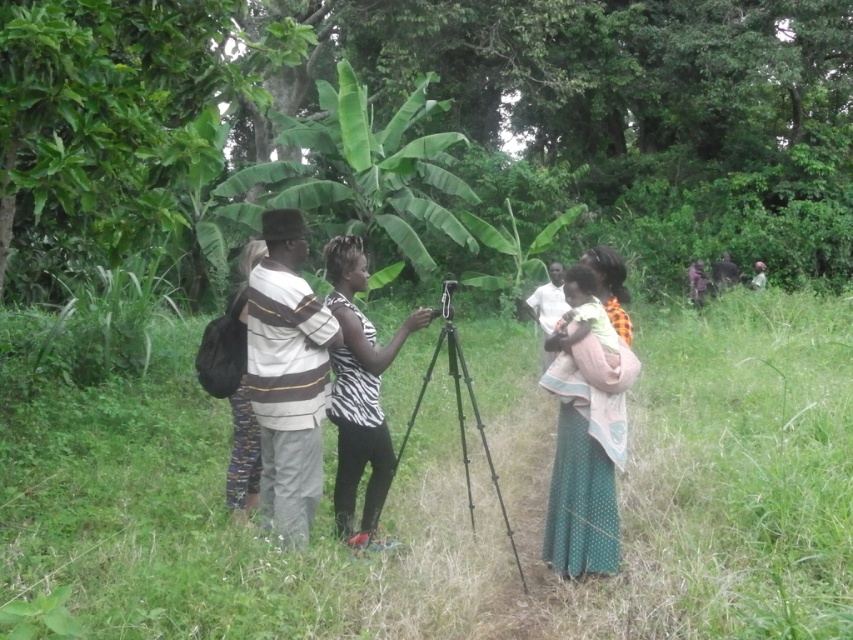
You are a photographer standing on the grassy path and want to adjust your equipment. You notice the dark brown leather jacket at right and the dark green fabric at right in your view. Which object is positioned more to the left side in your current view?

The dark brown leather jacket at right is positioned to the left of the dark green fabric at right, so the dark brown leather jacket at right is more to the left side in your current view.

You are a photographer setting up your equipment on the grassy path. You notice two items at the right side of your frame. One is the dark brown leather jacket at right and the other is the dark green fabric at right. Which of these two items would block more of the background tropical foliage when placed in front of it?

The dark brown leather jacket at right is bigger than the dark green fabric at right, so it would block more of the background tropical foliage when placed in front of it.